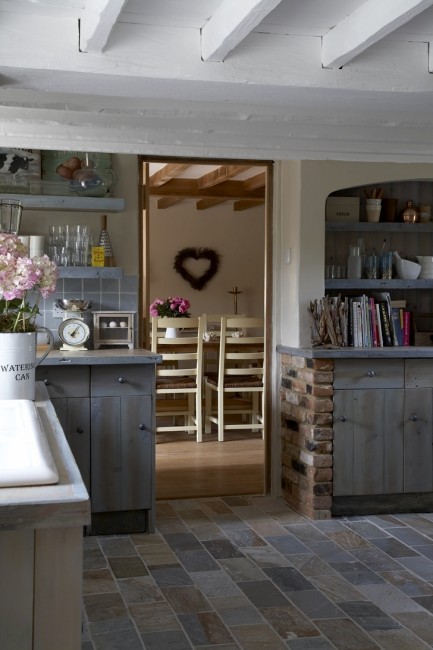
Find the location of a particular element. The height and width of the screenshot is (650, 433). heart shaped decoration is located at coordinates (209, 254).